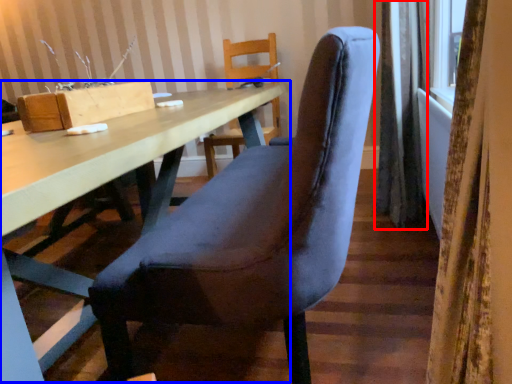
Question: Among these objects, which one is farthest to the camera, curtain (highlighted by a red box) or table (highlighted by a blue box)?

Choices:
 (A) curtain
 (B) table

Answer: (A)